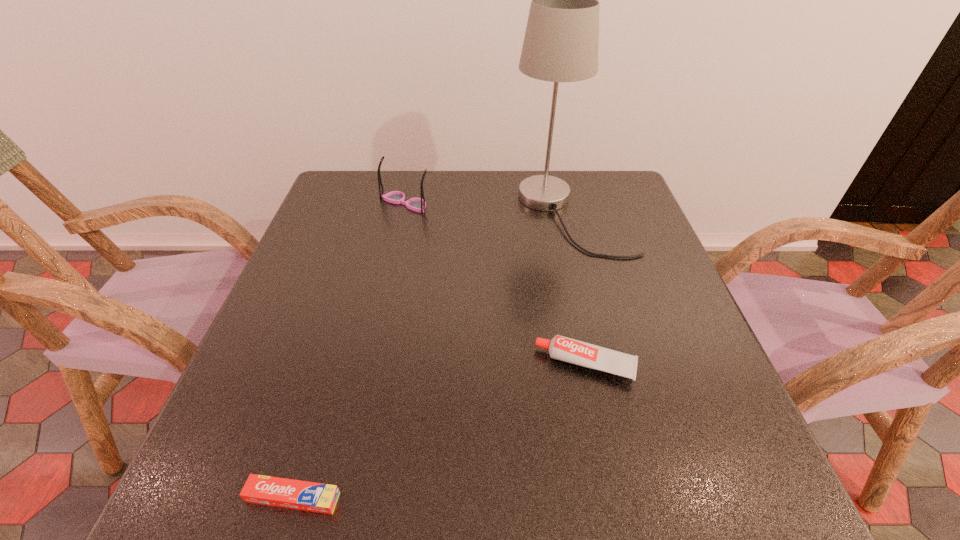
Identify the location of free space between the tallest object and the farther toothpaste. Image resolution: width=960 pixels, height=540 pixels. (578, 290).

Find the location of a particular element. free space between the second tallest object and the farther toothpaste is located at coordinates (495, 284).

You are a GUI agent. You are given a task and a screenshot of the screen. Output one action in this format:
    pyautogui.click(x=<x>, y=<y>)
    Task: Click on the free space between the taller toothpaste and the spectacles
    
    Given the screenshot: What is the action you would take?
    pyautogui.click(x=495, y=284)

Locate an element on the screen. This screenshot has height=540, width=960. empty space between the taller toothpaste and the tallest object is located at coordinates (578, 290).

Find the location of a particular element. free space between the second tallest object and the shortest object is located at coordinates (349, 350).

At what (x,y) coordinates should I click in order to perform the action: click on object identified as the second closest to the table lamp. Please return your answer as a coordinate pair (x, y). The image size is (960, 540). Looking at the image, I should click on (565, 349).

Locate which object ranks second in proximity to the nearer toothpaste. Please provide its 2D coordinates. Your answer should be formatted as a tuple, i.e. [(x, y)], where the tuple contains the x and y coordinates of a point satisfying the conditions above.

[(561, 42)]

I want to click on vacant point that satisfies the following two spatial constraints: 1. on the front side of the third shortest object; 2. on the left side of the taller toothpaste, so click(x=370, y=364).

At what (x,y) coordinates should I click in order to perform the action: click on blank area in the image that satisfies the following two spatial constraints: 1. on the back side of the farther toothpaste; 2. on the left side of the shorter toothpaste. Please return your answer as a coordinate pair (x, y). Looking at the image, I should click on (332, 364).

Identify the location of vacant region that satisfies the following two spatial constraints: 1. on the back side of the nearest object; 2. on the left side of the taller toothpaste. The image size is (960, 540). (332, 364).